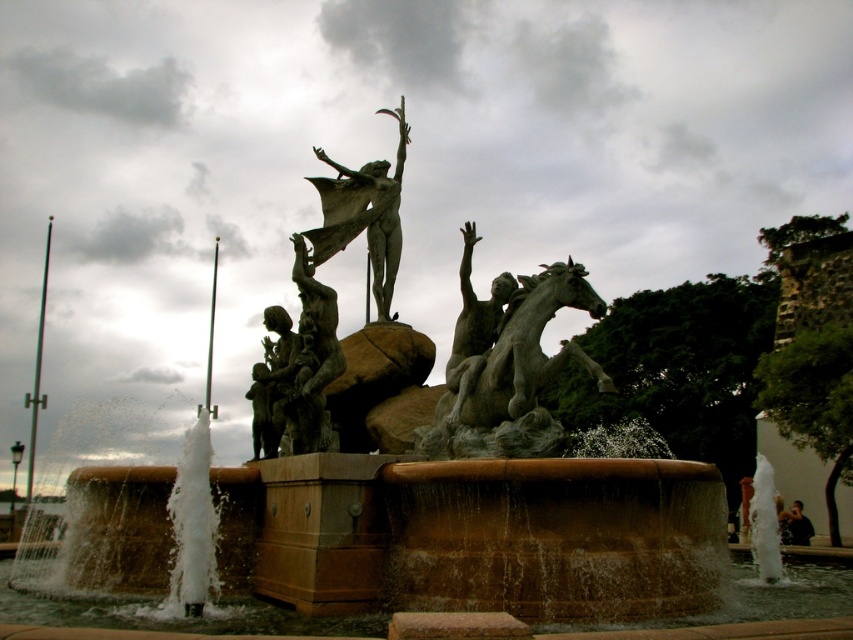
From the picture: You are a photographer standing at the edge of the fountain area. You want to capture a photo where both the bronze statue group at center and the black fabric person at lower right are visible in the frame. Considering their sizes, which object will appear larger in the photo?

The bronze statue group at center will appear larger in the photo because it is much taller than the black fabric person at lower right.

You are standing in front of the fountain sculpture and want to take a photo. The camera you have can focus on objects up to 100 meters away. Is the point at coordinates point (344, 246) within the camera focus range?

The distance of point (344, 246) from viewer is 92.54 meters, which is within the camera focus range of up to 100 meters. Yes, the point is within range.

You are standing at the base of the fountain and want to take a photo of the bronze statue of man at center without the black fabric person at lower right blocking the view. Is the statue visible from your current position?

Yes, the bronze statue of man at center is in front of the black fabric person at lower right, so it should be visible without obstruction from your current position at the base of the fountain.